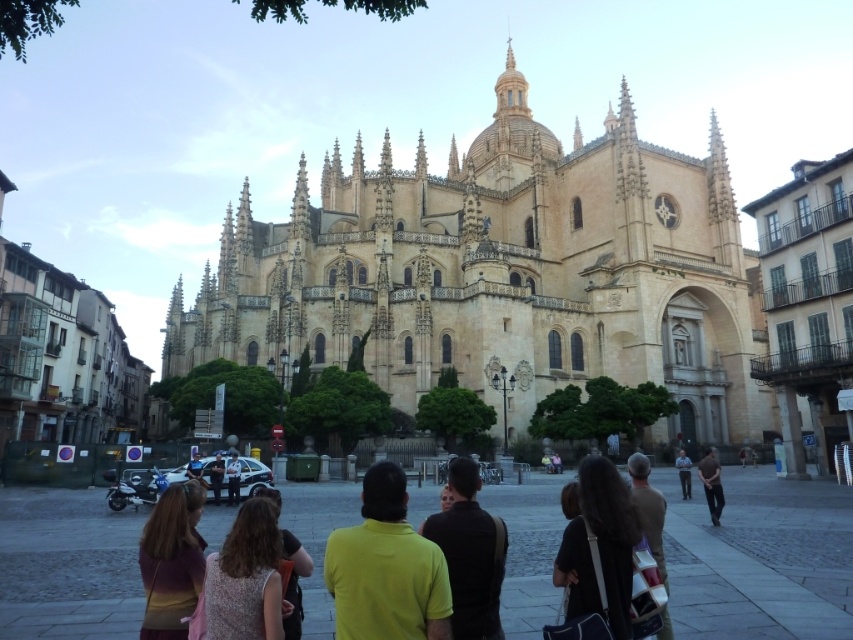
You are a tourist standing in the plaza in front of the cathedral. You want to take a photo of the golden stone church at center without any people blocking the view. Which direction should you move to ensure the dark blue uniform at center is out of the frame?

The golden stone church at center is to the left of the dark blue uniform at center. To avoid the dark blue uniform at center blocking the view, move to the left side of the dark blue uniform at center so that the golden stone church at center is positioned to its left and not obstructed.

You are standing in the plaza in front of the cathedral and want to take a photo that includes both the point at coordinates point (x=480, y=609) and point (x=228, y=480). Which point should you focus on first to ensure both are in clear view?

You should focus on point (x=480, y=609) first because it is closer to you than point (x=228, y=480), ensuring both points remain in focus.